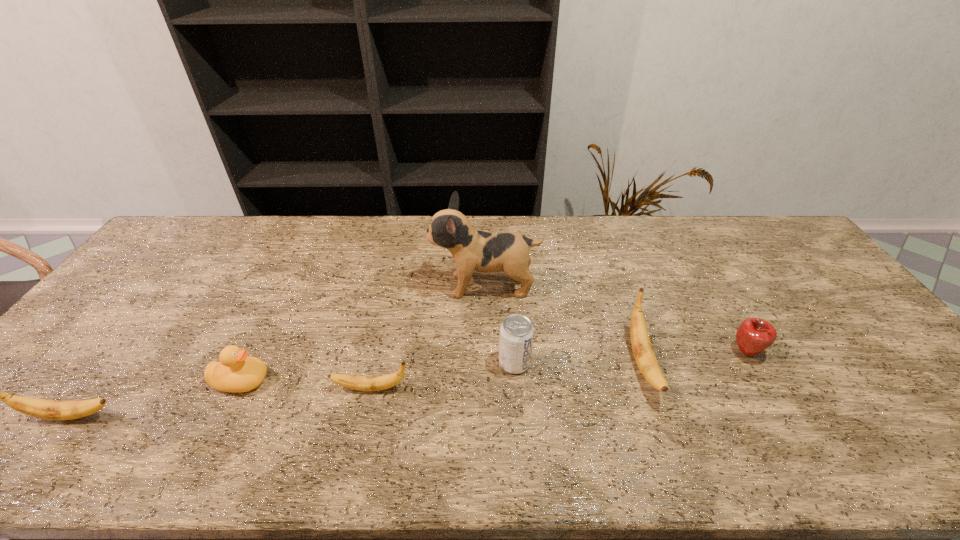
The width and height of the screenshot is (960, 540). I want to click on the second shortest banana, so click(41, 408).

This screenshot has height=540, width=960. In order to click on the leftmost banana in this screenshot , I will do `click(41, 408)`.

This screenshot has width=960, height=540. Find the location of `the fifth object from right to left`. the fifth object from right to left is located at coordinates (362, 383).

This screenshot has height=540, width=960. Identify the location of the shortest banana. (x=362, y=383).

You are a GUI agent. You are given a task and a screenshot of the screen. Output one action in this format:
    pyautogui.click(x=<x>, y=<y>)
    Task: Click on the second object from right to left
    Image resolution: width=960 pixels, height=540 pixels.
    Given the screenshot: What is the action you would take?
    pyautogui.click(x=645, y=358)

Locate an element on the screen. This screenshot has height=540, width=960. soda can is located at coordinates (516, 332).

I want to click on puppy, so click(472, 250).

The height and width of the screenshot is (540, 960). Identify the location of the tallest object. pos(472,250).

I want to click on the sixth object from right to left, so click(236, 372).

Find the location of a particular element. Image resolution: width=960 pixels, height=540 pixels. apple is located at coordinates (754, 335).